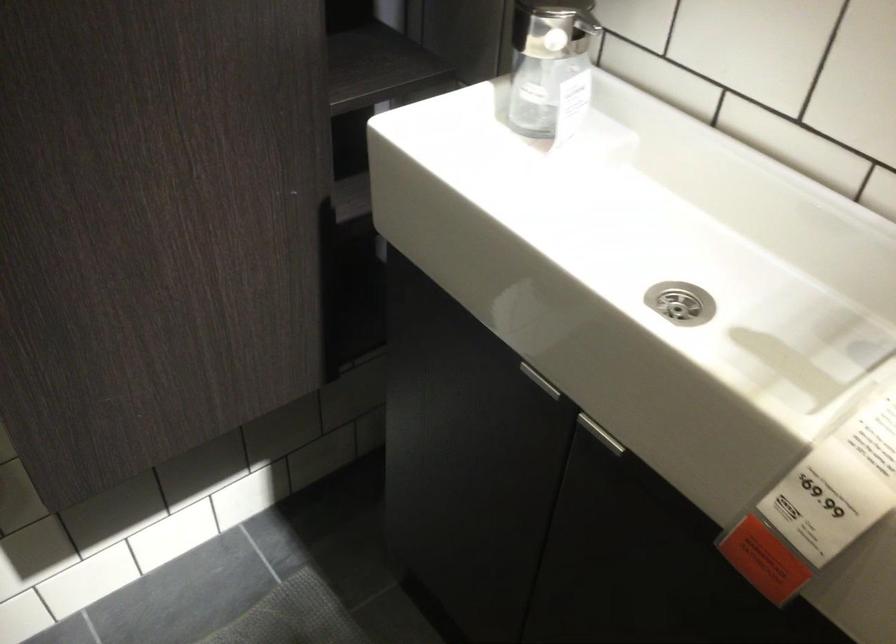
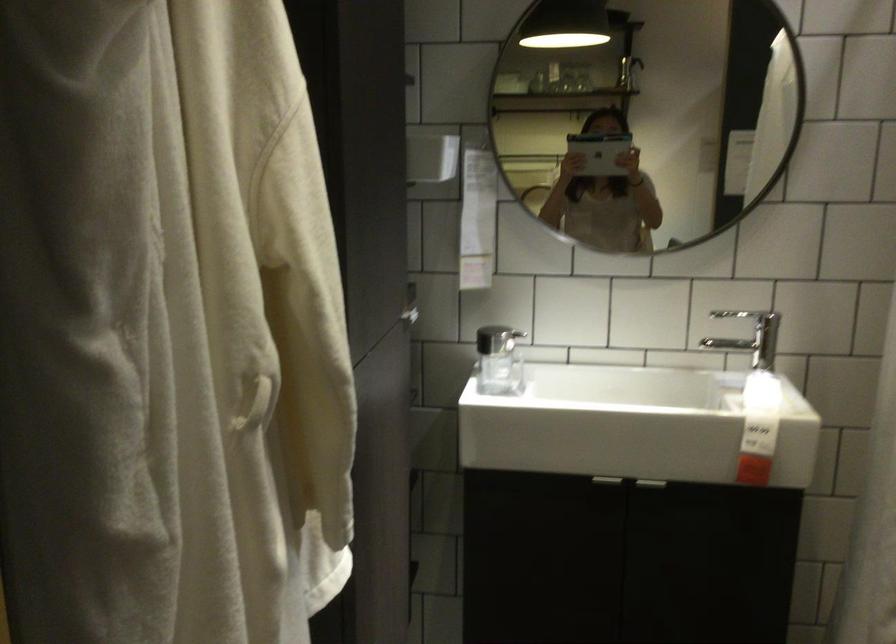
Find the pixel in the second image that matches (538,366) in the first image.

(607, 480)